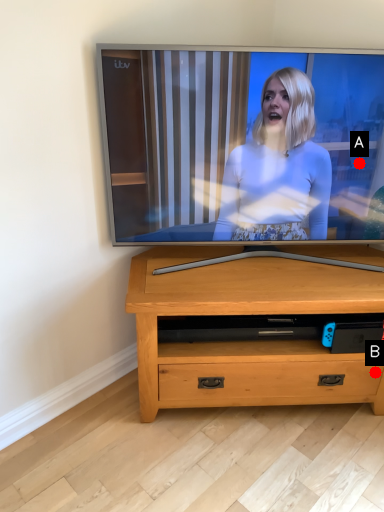
Question: Two points are circled on the image, labeled by A and B beside each circle. Which of the following is the farthest from the observer?

Choices:
 (A) A is further
 (B) B is further

Answer: (B)